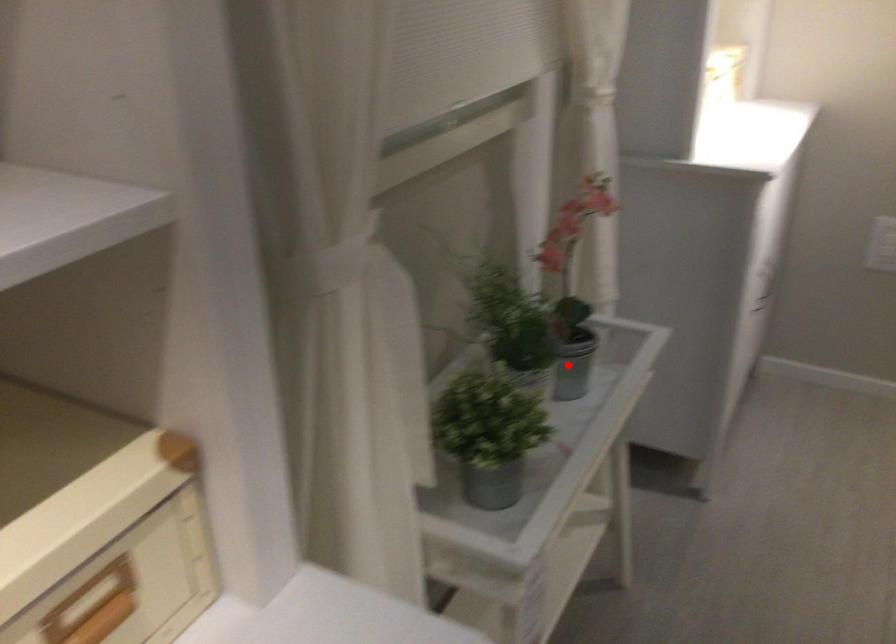
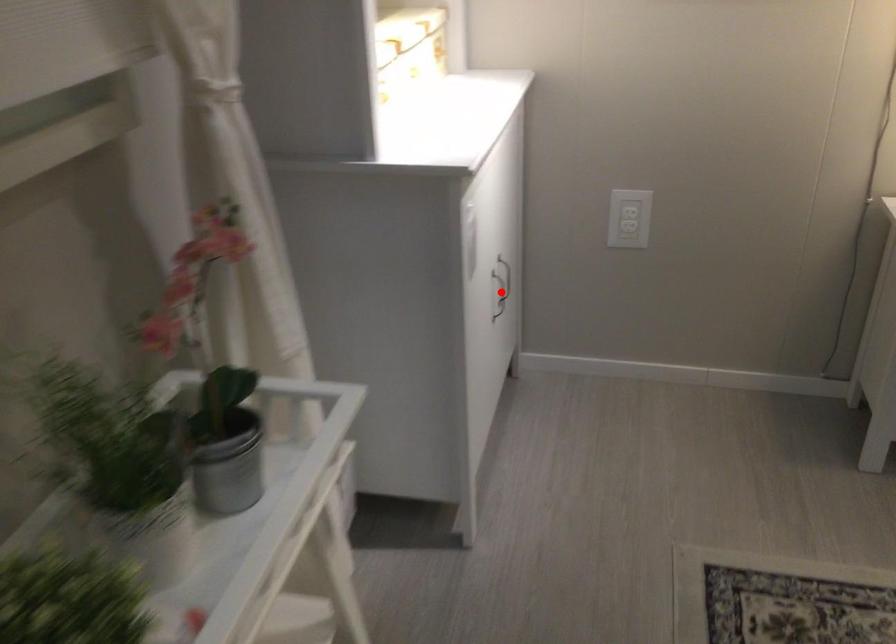
I am providing you with two images of the same scene from different viewpoints. A red point is marked on the first image and another point is marked on the second image. Is the red point in image1 aligned with the point shown in image2?

No